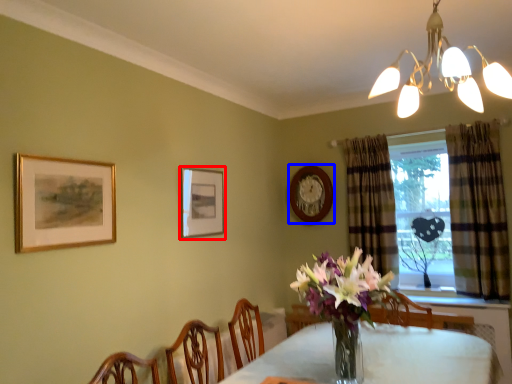
Question: Which of the following is the farthest to the observer, picture frame (highlighted by a red box) or picture frame (highlighted by a blue box)?

Choices:
 (A) picture frame
 (B) picture frame

Answer: (B)